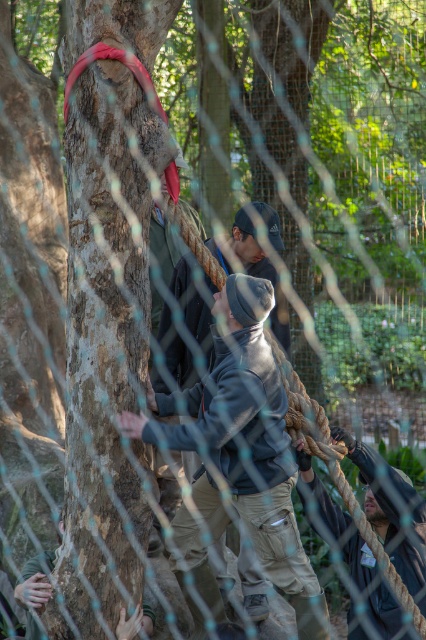
Is point (201, 541) in front of point (357, 572)?

That is False.

Who is positioned more to the right, gray fleece jacket at center or dark gray fabric at lower right?

dark gray fabric at lower right

Is point (250, 308) closer to camera compared to point (402, 500)?

Yes.

At what (x,y) coordinates should I click in order to perform the action: click on gray fleece jacket at center. Please return your answer as a coordinate pair (x, y). The width and height of the screenshot is (426, 640). Looking at the image, I should click on (244, 442).